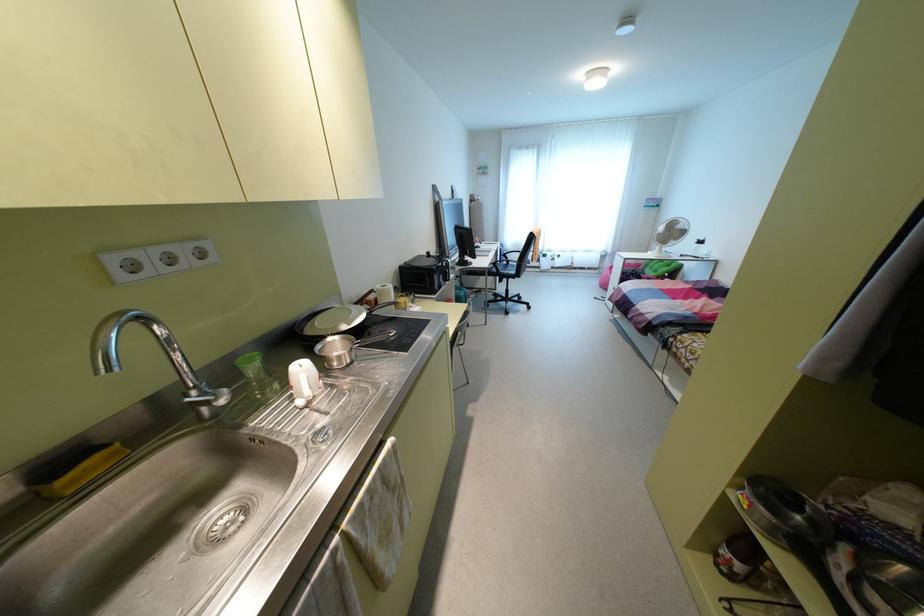
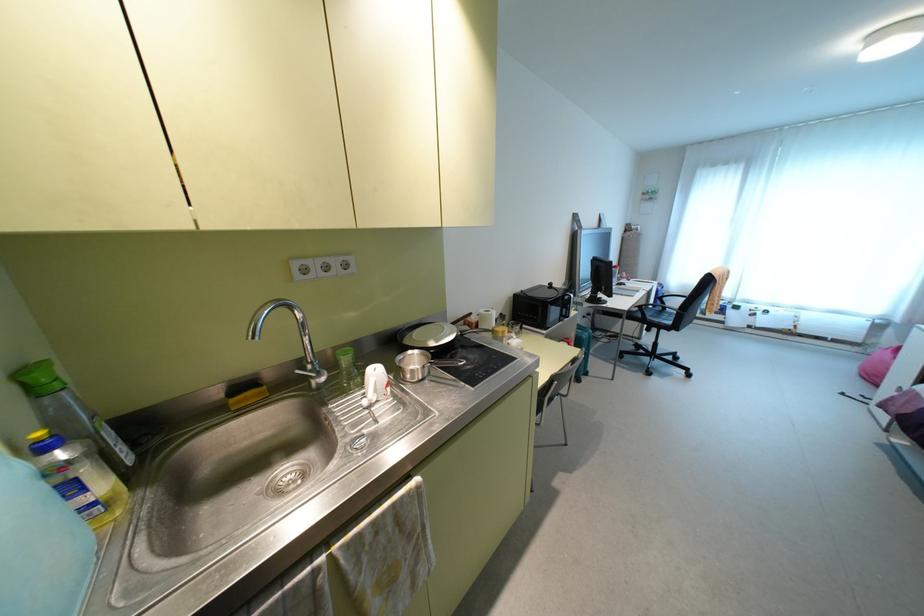
Question: The images are taken continuously from a first-person perspective. In which direction is your viewpoint rotating?

Choices:
 (A) Left
 (B) Right
 (C) Up
 (D) Down

Answer: (A)